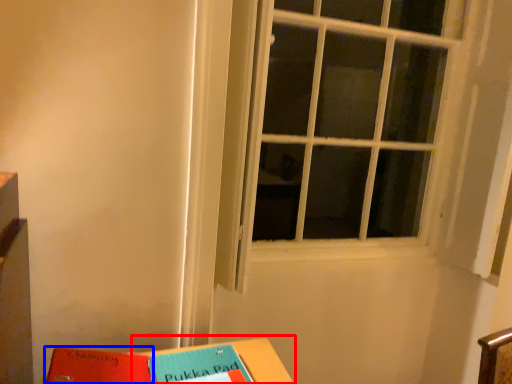
Question: Which point is further to the camera, table (highlighted by a red box) or paperback book (highlighted by a blue box)?

Choices:
 (A) table
 (B) paperback book

Answer: (B)